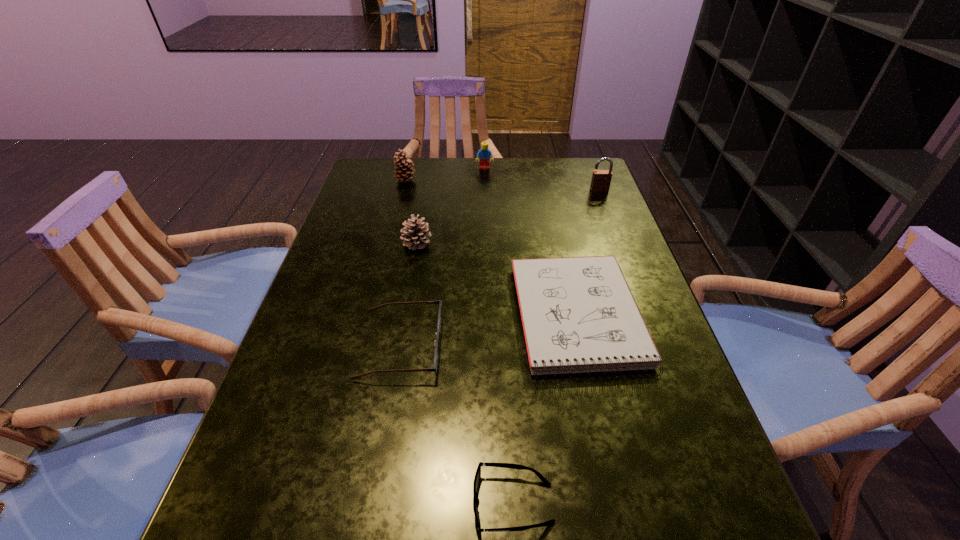
This screenshot has width=960, height=540. Find the location of `the fifth nearest object`. the fifth nearest object is located at coordinates (601, 179).

Image resolution: width=960 pixels, height=540 pixels. Identify the location of the farther pinecone. (405, 170).

This screenshot has width=960, height=540. In order to click on the taller pinecone in this screenshot , I will do `click(405, 170)`.

Identify the location of Lego. (484, 154).

This screenshot has height=540, width=960. Find the location of `the shorter pinecone`. the shorter pinecone is located at coordinates (414, 235).

At what (x,y) coordinates should I click in order to perform the action: click on the nearer pinecone. Please return your answer as a coordinate pair (x, y). Image resolution: width=960 pixels, height=540 pixels. Looking at the image, I should click on (414, 235).

The width and height of the screenshot is (960, 540). I want to click on spectacles, so click(436, 342).

Find the location of a particular element. notepad is located at coordinates (578, 314).

Where is `the nearest object`? The height and width of the screenshot is (540, 960). the nearest object is located at coordinates (477, 480).

Find the location of a particular element. Image resolution: width=960 pixels, height=540 pixels. the shortest object is located at coordinates (477, 480).